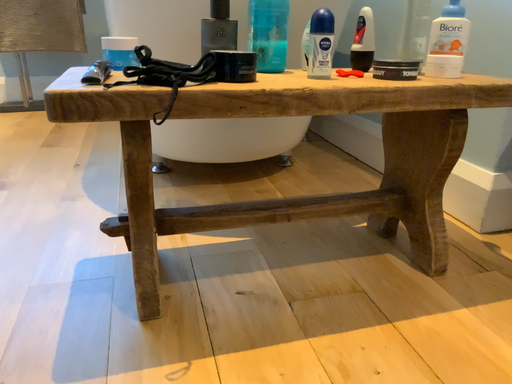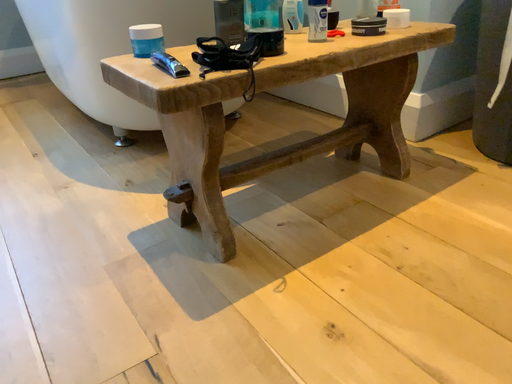
Question: How did the camera likely rotate when shooting the video?

Choices:
 (A) rotated left
 (B) rotated right

Answer: (B)